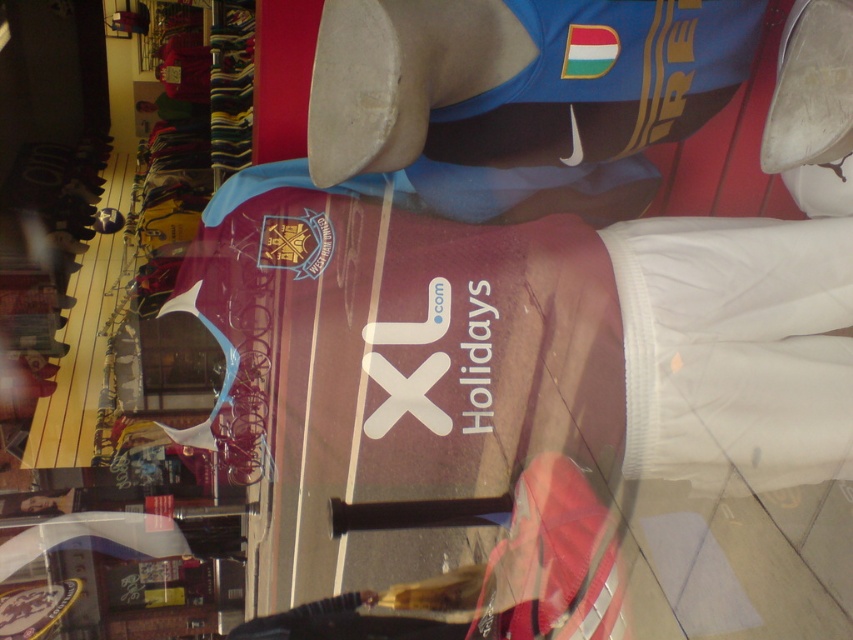
You are a customer in the shop looking at the white matte shoe at center and the white matte shoe at upper center. Which shoe is shorter in height?

The white matte shoe at center is shorter in height compared to the white matte shoe at upper center.